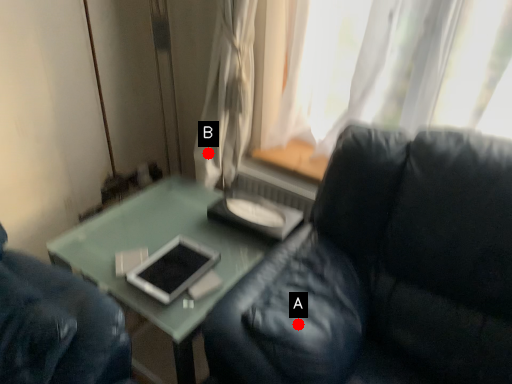
Question: Two points are circled on the image, labeled by A and B beside each circle. Which point is closer to the camera?

Choices:
 (A) A is closer
 (B) B is closer

Answer: (A)